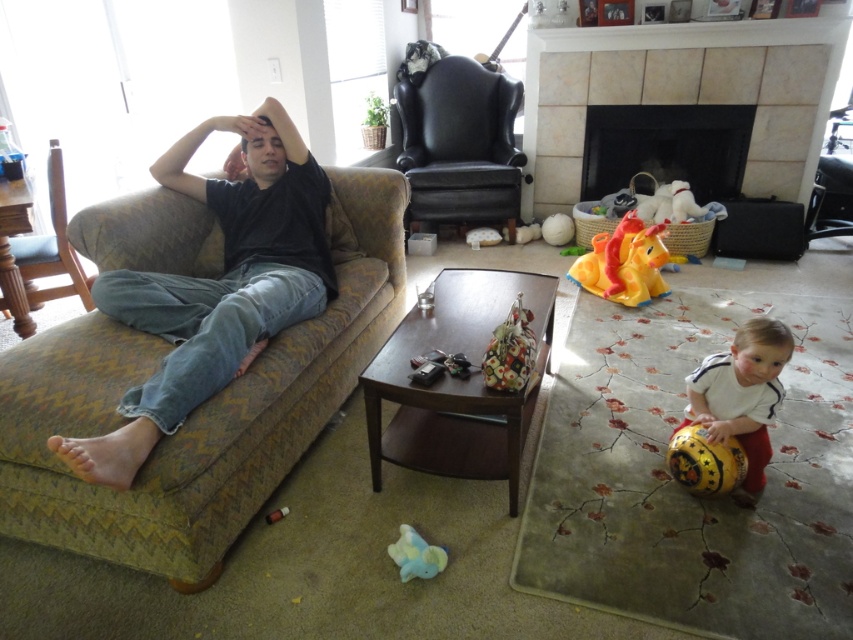
Where is the smooth skin head at lower right located in the image?

The smooth skin head at lower right is located at point (759,349).

Which object is located at the coordinates point (195, 410)?

The point (195, 410) is located on the green zigzag fabric couch at left.